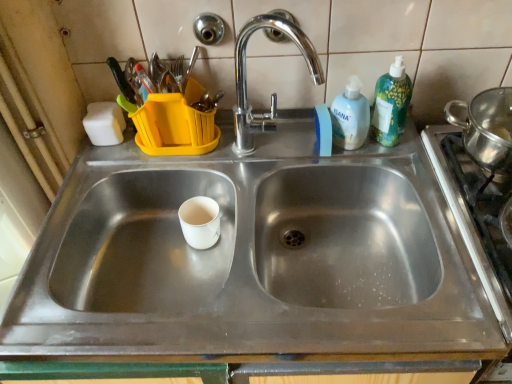
Where is `unoccupied region to the right of white matte sponge at upper left`? Image resolution: width=512 pixels, height=384 pixels. unoccupied region to the right of white matte sponge at upper left is located at coordinates (177, 150).